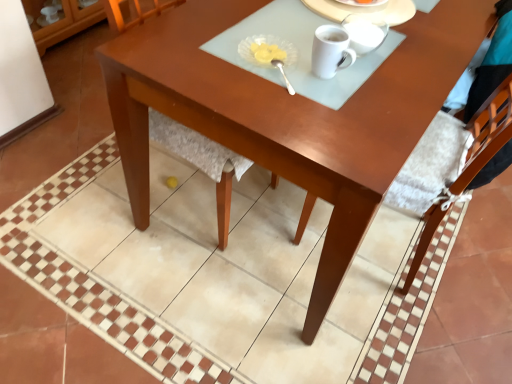
Image resolution: width=512 pixels, height=384 pixels. I want to click on free space that is to the left of white glossy mug at upper center, so (254, 67).